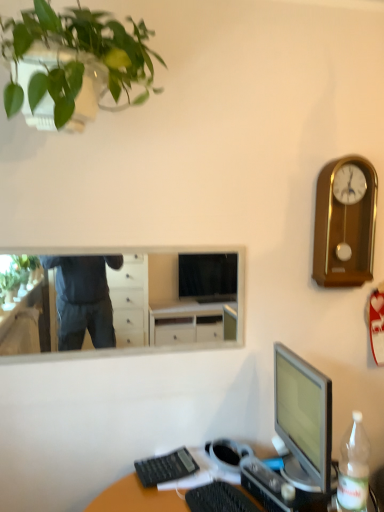
You are a GUI agent. You are given a task and a screenshot of the screen. Output one action in this format:
    pyautogui.click(x=<x>, y=<y>)
    Task: Click on the vacant location below black plastic keyboard at lower center, which ranks as the first computer keyboard in back-to-front order (from a real-world perspective)
    
    Given the screenshot: What is the action you would take?
    pyautogui.click(x=173, y=465)